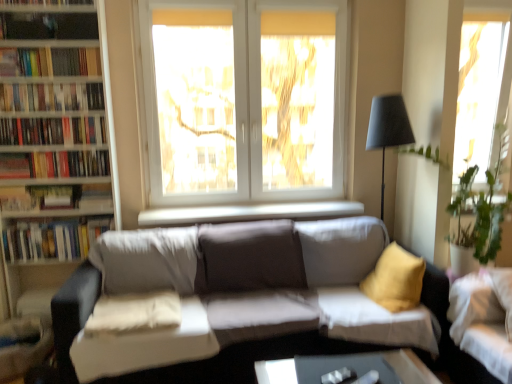
Question: Is hardcover books at upper left, the 1th book positioned from the top, at the left side of white soft pillow at center?

Choices:
 (A) no
 (B) yes

Answer: (B)

Question: From a real-world perspective, does hardcover books at upper left, the 1th book positioned from the top, sit lower than white soft pillow at center?

Choices:
 (A) no
 (B) yes

Answer: (A)

Question: Does hardcover books at upper left, the fifth book from the bottom, have a lesser height compared to white soft pillow at center?

Choices:
 (A) yes
 (B) no

Answer: (B)

Question: Is hardcover books at upper left, the 1th book positioned from the top, taller than white soft pillow at center?

Choices:
 (A) no
 (B) yes

Answer: (B)

Question: From the image's perspective, is hardcover books at upper left, the fifth book from the bottom, on white soft pillow at center?

Choices:
 (A) yes
 (B) no

Answer: (A)

Question: Considering the relative positions of hardcover books at left, positioned as the second book in bottom-to-top order, and white wooden bookcase at left in the image provided, is hardcover books at left, positioned as the second book in bottom-to-top order, to the left or to the right of white wooden bookcase at left?

Choices:
 (A) left
 (B) right

Answer: (B)

Question: Is point (98, 152) closer or farther from the camera than point (16, 309)?

Choices:
 (A) farther
 (B) closer

Answer: (B)

Question: In the image, is hardcover books at left, positioned as the second book in bottom-to-top order, positioned in front of or behind white wooden bookcase at left?

Choices:
 (A) front
 (B) behind

Answer: (B)

Question: Based on their sizes in the image, would you say hardcover books at left, which is the fourth book from top to bottom, is bigger or smaller than white wooden bookcase at left?

Choices:
 (A) small
 (B) big

Answer: (A)

Question: Considering the positions of hardcover books at left, marked as the 3th book in a top-to-bottom arrangement, and hardcover books at left, which is the fourth book from top to bottom, in the image, is hardcover books at left, marked as the 3th book in a top-to-bottom arrangement, bigger or smaller than hardcover books at left, which is the fourth book from top to bottom,?

Choices:
 (A) big
 (B) small

Answer: (A)

Question: From the image's perspective, is hardcover books at left, the 3th book when ordered from bottom to top, located above or below hardcover books at left, positioned as the second book in bottom-to-top order?

Choices:
 (A) below
 (B) above

Answer: (B)

Question: From a real-world perspective, is hardcover books at left, marked as the 3th book in a top-to-bottom arrangement, above or below hardcover books at left, which is the fourth book from top to bottom?

Choices:
 (A) below
 (B) above

Answer: (B)

Question: Considering their positions, is hardcover books at left, marked as the 3th book in a top-to-bottom arrangement, located in front of or behind hardcover books at left, positioned as the second book in bottom-to-top order?

Choices:
 (A) front
 (B) behind

Answer: (A)

Question: Is white soft pillow at center to the left or to the right of white fabric couch at lower right, which is the 1th studio couch from right to left, in the image?

Choices:
 (A) left
 (B) right

Answer: (A)

Question: Considering the positions of white soft pillow at center and white fabric couch at lower right, placed as the second studio couch when sorted from left to right, in the image, is white soft pillow at center wider or thinner than white fabric couch at lower right, placed as the second studio couch when sorted from left to right,?

Choices:
 (A) wide
 (B) thin

Answer: (A)